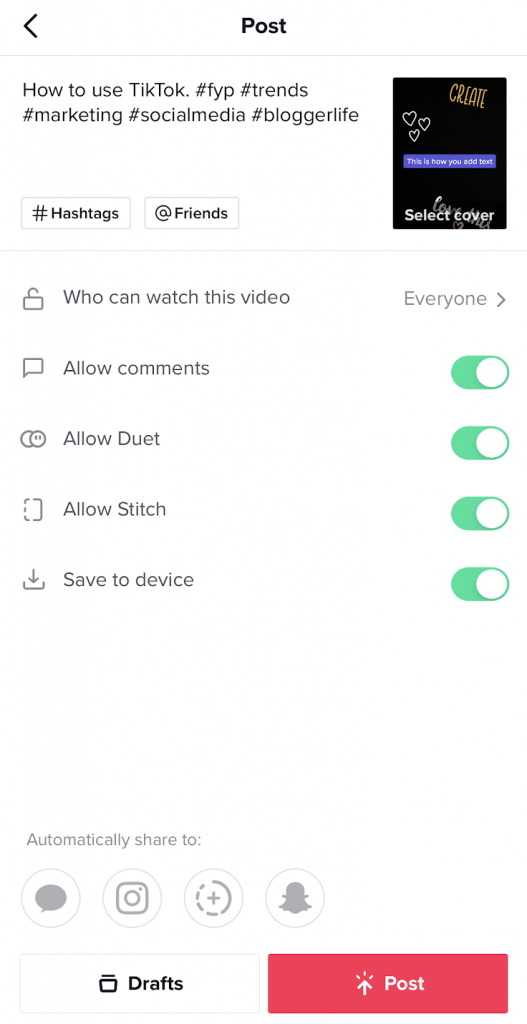
The height and width of the screenshot is (1024, 527). Identify the location of toggle on off button. (512, 372), (512, 435), (517, 506), (516, 572).